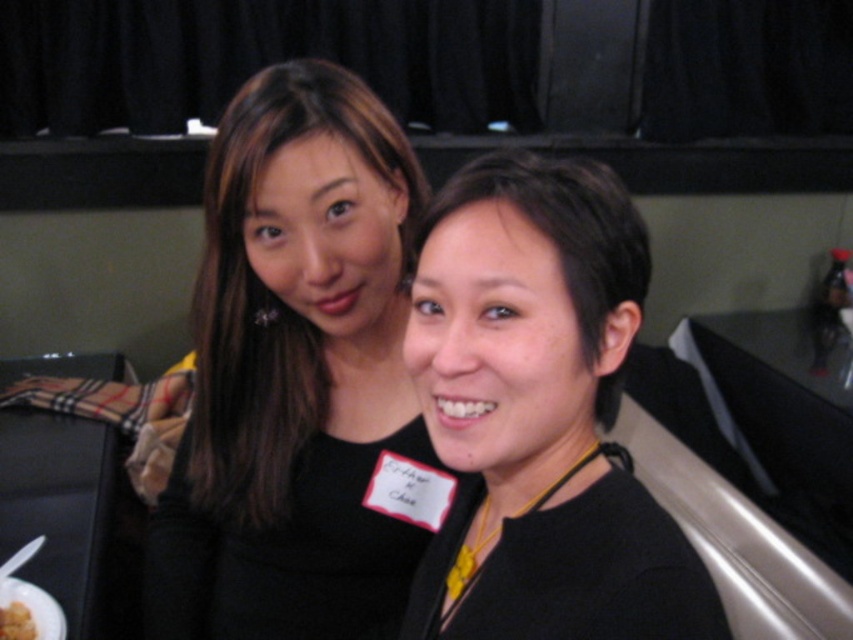
You are a photographer standing at the camera position. You want to place a decorative bowl that is 1.5 feet in diameter on the table where the white matte plate at lower left is located. Will the bowl fit on the table without overlapping the plate?

The white matte plate at lower left is 3.34 feet from the camera. Since the bowl is 1.5 feet in diameter, there is enough space on the table to place it without overlapping the plate, provided the table is sufficiently large. However, the exact placement depends on the table dimensions not specified here.

Based on the photo, you are a photographer setting up for a group photo. You see the black matte dress at center and the white matte plate at lower left. Which object is positioned to the right of the other?

The black matte dress at center is to the right of the white matte plate at lower left.